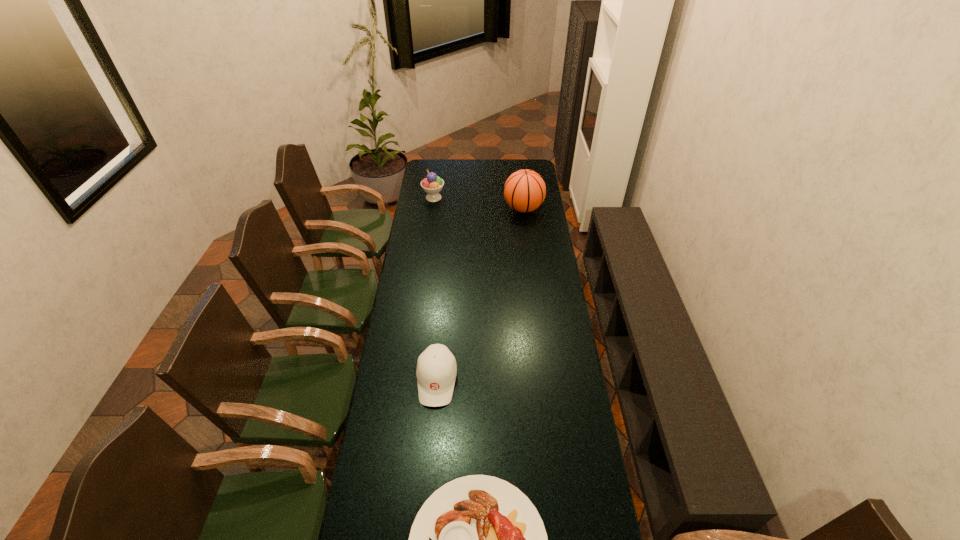
In the image, there is a desktop. At what (x,y) coordinates should I click in order to perform the action: click on blank space at the far edge. Please return your answer as a coordinate pair (x, y). The width and height of the screenshot is (960, 540). Looking at the image, I should click on (494, 178).

Locate an element on the screen. vacant space at the left edge of the desktop is located at coordinates (405, 377).

Locate an element on the screen. free spot at the right edge of the desktop is located at coordinates (520, 238).

Where is `free space at the far left corner of the desktop`? The image size is (960, 540). free space at the far left corner of the desktop is located at coordinates (424, 170).

Find the location of a particular element. vacant space at the far right corner of the desktop is located at coordinates (527, 167).

At what (x,y) coordinates should I click in order to perform the action: click on free space between the second nearest object and the basketball. Please return your answer as a coordinate pair (x, y). Looking at the image, I should click on (480, 294).

Locate an element on the screen. This screenshot has height=540, width=960. free space that is in between the basketball and the third tallest object is located at coordinates (480, 294).

Where is `free spot between the basketball and the third tallest object`? This screenshot has width=960, height=540. free spot between the basketball and the third tallest object is located at coordinates (480, 294).

I want to click on the closest object to the nearest object, so click(436, 371).

This screenshot has height=540, width=960. I want to click on the second closest object to the tallest object, so click(436, 371).